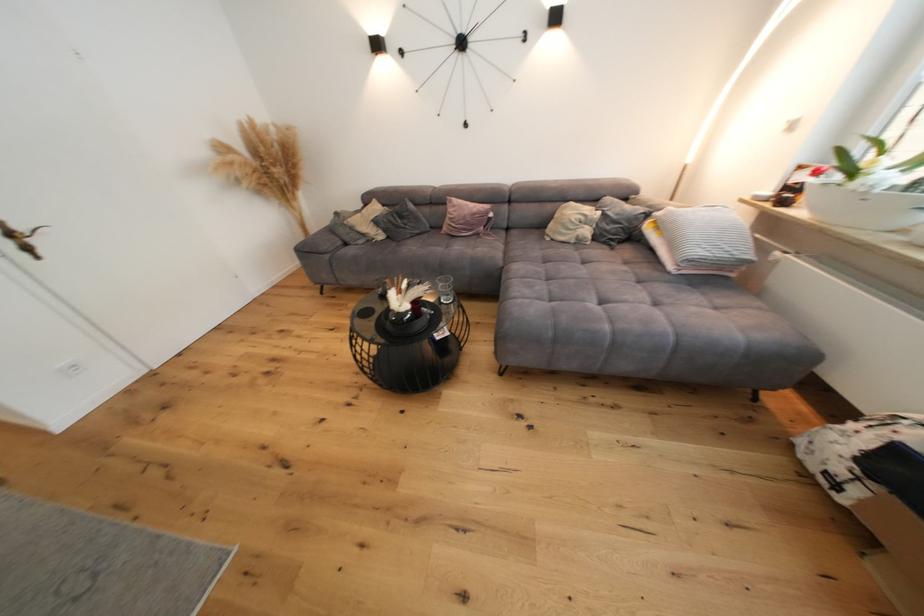
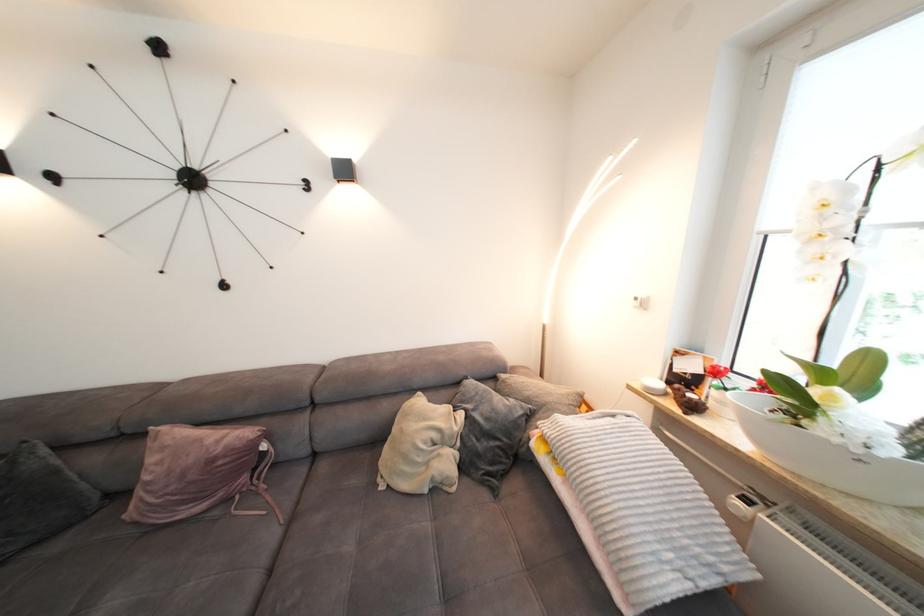
In the second image, find the point that corresponds to (763,200) in the first image.

(657, 391)